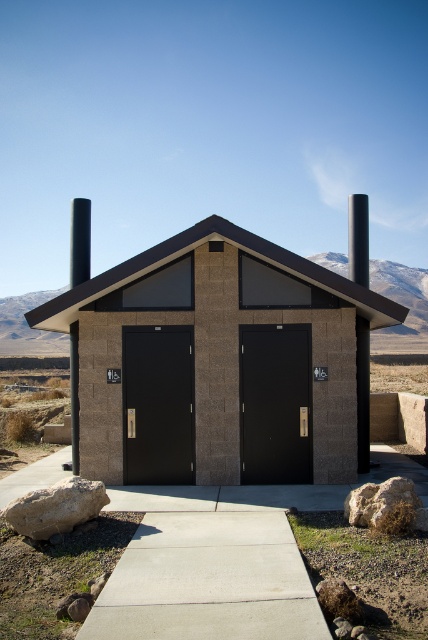
Locate an element on the screen. brown textured concrete hut at center is located at coordinates (216, 358).

Can you confirm if brown textured concrete hut at center is wider than black matte door at center?

Correct, the width of brown textured concrete hut at center exceeds that of black matte door at center.

Between point (228, 237) and point (122, 333), which one is positioned in front?

Positioned in front is point (228, 237).

In order to click on brown textured concrete hut at center in this screenshot , I will do `click(216, 358)`.

Can you confirm if brown textured concrete hut at center is positioned to the left of matte black door at center?

Yes, brown textured concrete hut at center is to the left of matte black door at center.

The height and width of the screenshot is (640, 428). I want to click on brown textured concrete hut at center, so click(216, 358).

Is point (238, 333) positioned after point (297, 364)?

Yes, it is.

Where is `brown textured concrete hut at center`? brown textured concrete hut at center is located at coordinates (216, 358).

Is matte black door at center thinner than black matte door at center?

Yes, matte black door at center is thinner than black matte door at center.

Does point (276, 397) come behind point (148, 348)?

No, it is in front of (148, 348).

The image size is (428, 640). I want to click on matte black door at center, so click(276, 403).